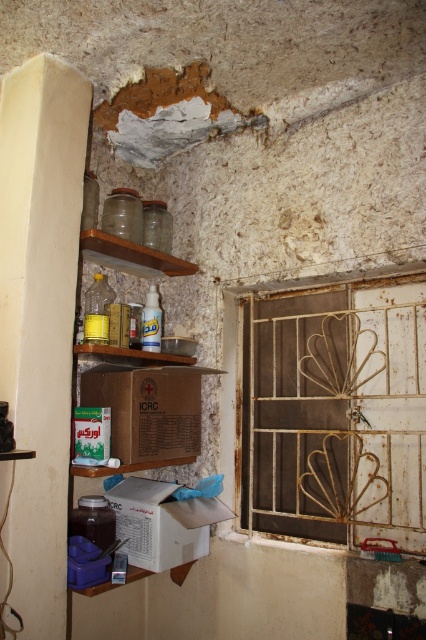
Question: Does brown cardboard box at center have a greater width compared to brown wooden shelf at upper left?

Choices:
 (A) yes
 (B) no

Answer: (A)

Question: Can you confirm if brown cardboard box at center is positioned to the right of white cardboard box at lower center?

Choices:
 (A) no
 (B) yes

Answer: (A)

Question: Which of the following is the closest to the observer?

Choices:
 (A) rusty metal gate at center-right
 (B) brown cardboard box at center
 (C) brown wooden shelf at upper left
 (D) white cardboard box at lower center

Answer: (A)

Question: Which of the following is the farthest from the observer?

Choices:
 (A) rusty metal gate at center-right
 (B) white cardboard box at lower center

Answer: (B)

Question: Which object is farther from the camera taking this photo?

Choices:
 (A) brown wooden shelf at upper left
 (B) rusty metal gate at center-right

Answer: (A)

Question: Observing the image, what is the correct spatial positioning of rusty metal gate at center-right in reference to brown cardboard box at center?

Choices:
 (A) above
 (B) below

Answer: (A)